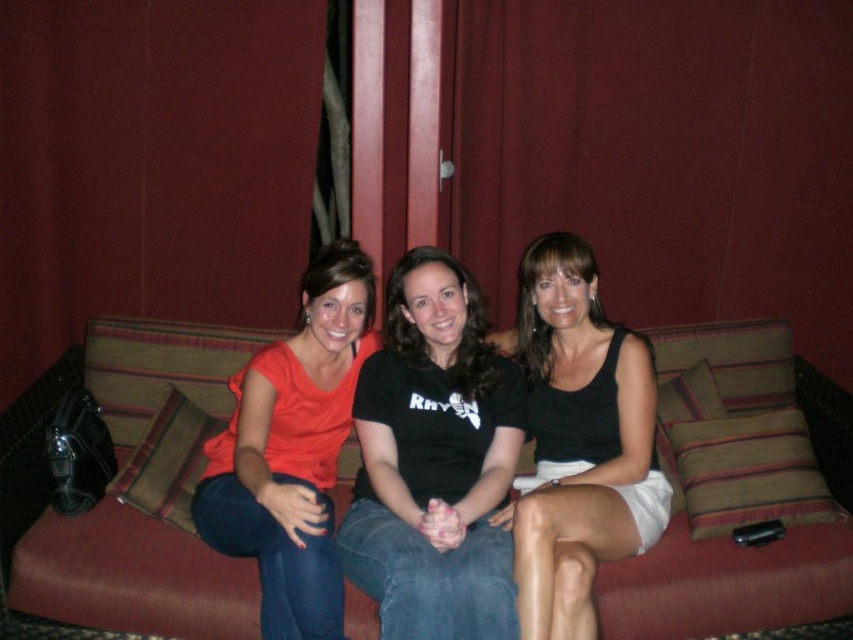
You are standing in front of the couch where the three women are sitting. You want to place a small decorative pillow exactly at the point marked as point (131, 577). Based on the scene description, where would this pillow be placed relative to the couch?

The point (131, 577) is located on the textured fabric couch at center, so placing the decorative pillow there would position it directly on the couch.

You are trying to decide whether to place a new throw pillow on the textured fabric couch at center. The pillow is the same size as the matte orange shirt at center. Based on the image, can the couch accommodate the pillow?

The textured fabric couch at center might be wider than matte orange shirt at center, so there is a possibility that the couch can accommodate the pillow, but the exact dimensions are uncertain.